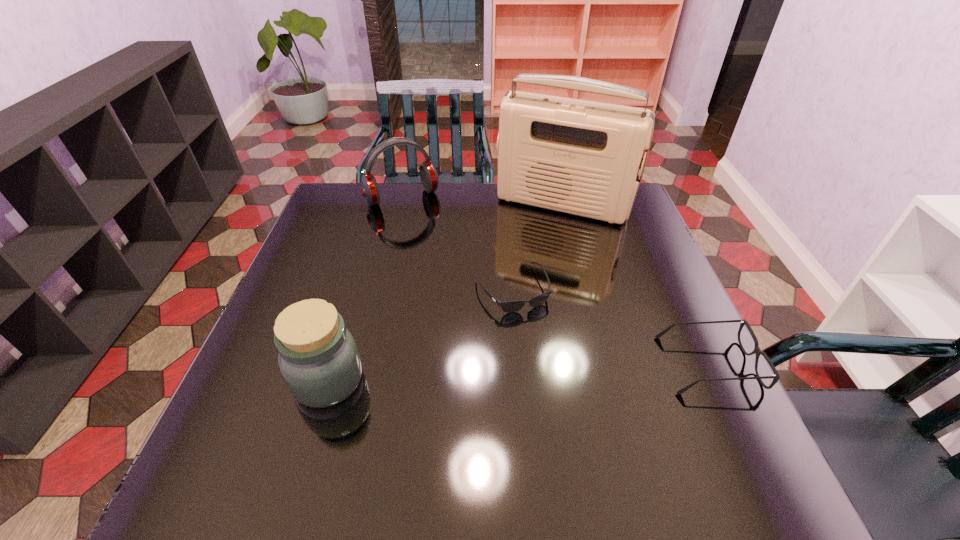
Identify the location of jar. The height and width of the screenshot is (540, 960). (319, 360).

Find the location of a particular element. Image resolution: width=960 pixels, height=540 pixels. the fourth tallest object is located at coordinates (757, 351).

You are a GUI agent. You are given a task and a screenshot of the screen. Output one action in this format:
    pyautogui.click(x=<x>, y=<y>)
    Task: Click on the tallest object
    
    Given the screenshot: What is the action you would take?
    pyautogui.click(x=581, y=157)

Identify the location of earphone. This screenshot has width=960, height=540. (429, 177).

Identify the location of the third nearest object. (510, 306).

Identify the location of the shortest object. This screenshot has height=540, width=960. (510, 306).

Where is `vacant point located 0.270m on the back of the jar`? The width and height of the screenshot is (960, 540). vacant point located 0.270m on the back of the jar is located at coordinates (361, 271).

You are a GUI agent. You are given a task and a screenshot of the screen. Output one action in this format:
    pyautogui.click(x=<x>, y=<y>)
    Task: Click on the vacant point located with the lenses facing outward on the spectacles
    This screenshot has height=540, width=960.
    Given the screenshot: What is the action you would take?
    pyautogui.click(x=575, y=364)

The width and height of the screenshot is (960, 540). I want to click on free space located with the lenses facing outward on the spectacles, so click(x=510, y=364).

Find the location of `free space located with the lenses facing outward on the spectacles`. free space located with the lenses facing outward on the spectacles is located at coordinates 533,364.